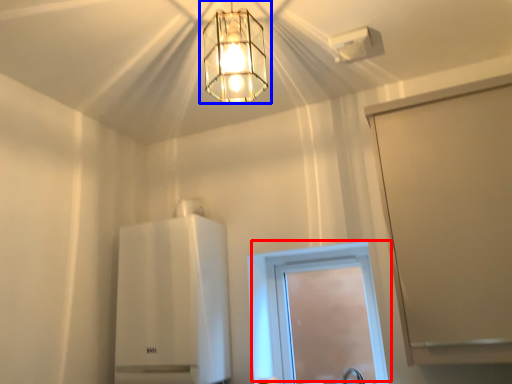
Question: Which object is closer to the camera taking this photo, window (highlighted by a red box) or lamp (highlighted by a blue box)?

Choices:
 (A) window
 (B) lamp

Answer: (B)